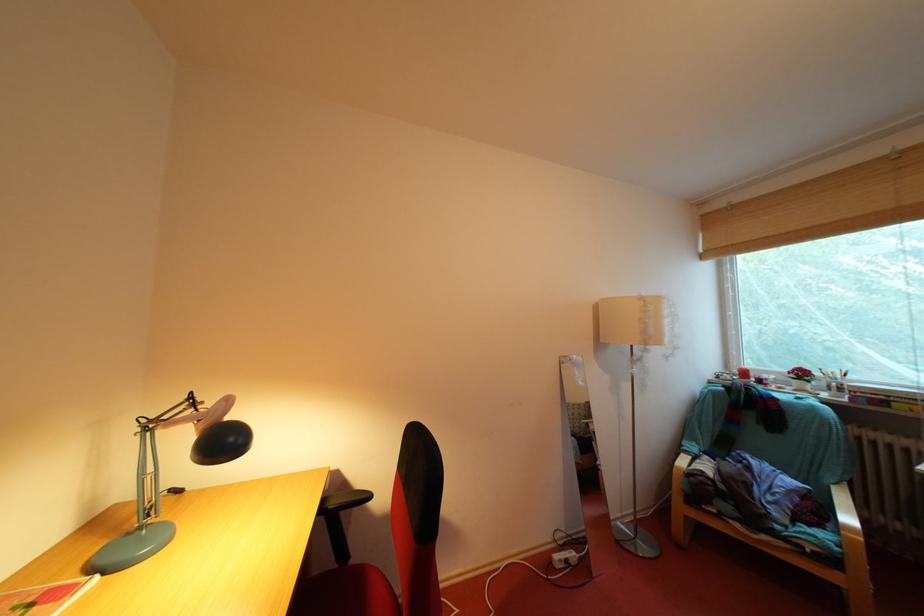
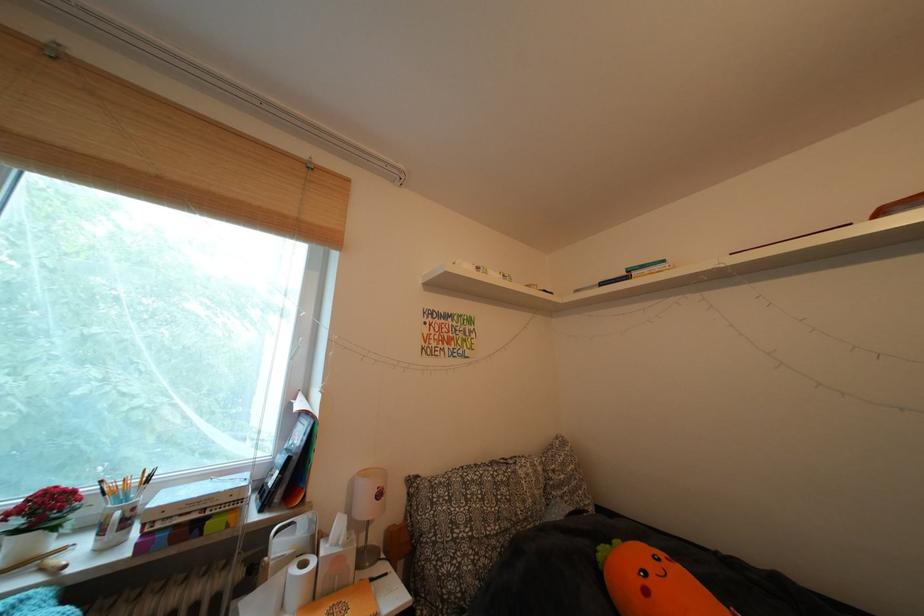
Find the pixel in the second image that matches point (811, 379) in the first image.

(56, 513)